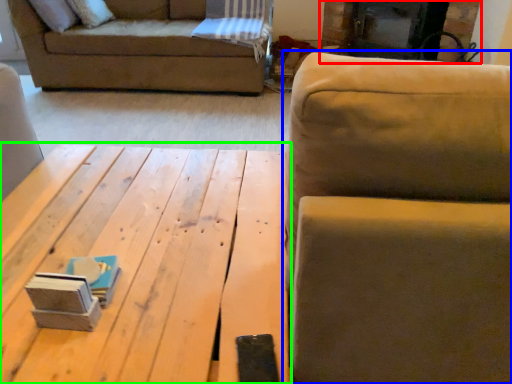
Question: Which object is positioned closest to fireplace (highlighted by a red box)? Select from studio couch (highlighted by a blue box) and table (highlighted by a green box).

Choices:
 (A) studio couch
 (B) table

Answer: (B)